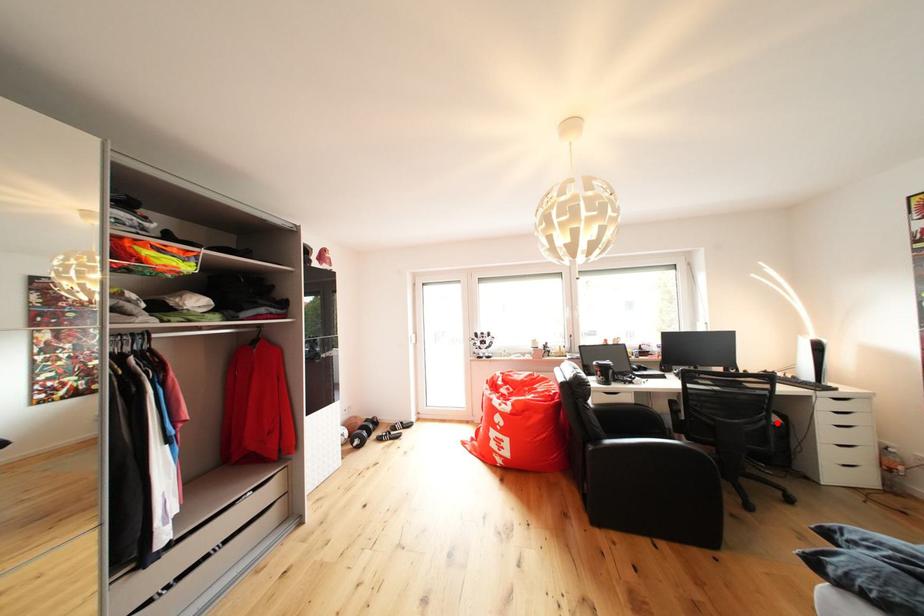
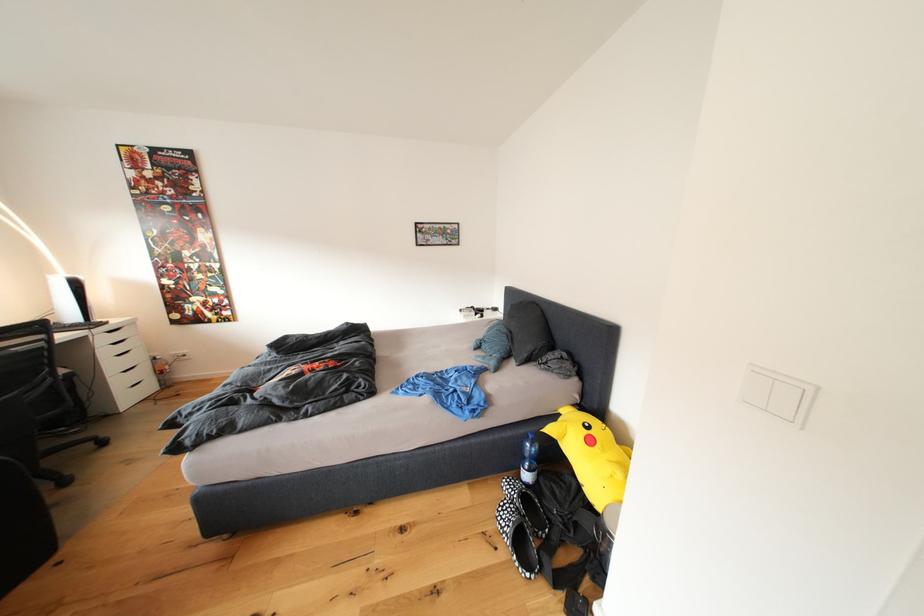
In the second image, find the point that corresponds to the highlighted location in the first image.

(63, 378)